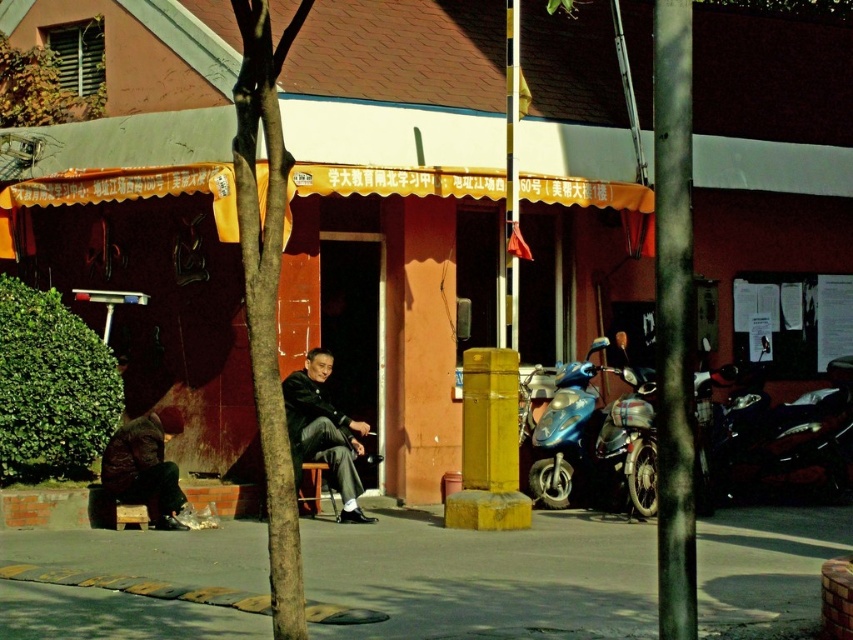
Question: Observing the image, what is the correct spatial positioning of brown leather jacket at lower left in reference to wooden chair at center?

Choices:
 (A) above
 (B) below

Answer: (A)

Question: Can you confirm if blue metallic motorcycle at lower right is bigger than wooden chair at center?

Choices:
 (A) no
 (B) yes

Answer: (B)

Question: Which of the following is the farthest from the observer?

Choices:
 (A) blue metallic motorcycle at lower right
 (B) dark gray fabric jacket at center

Answer: (A)

Question: Which object appears farthest from the camera in this image?

Choices:
 (A) blue metallic motorcycle at lower right
 (B) brown leather jacket at lower left

Answer: (A)

Question: Is smooth brown tree trunk at center-left below dark gray fabric jacket at center?

Choices:
 (A) yes
 (B) no

Answer: (B)

Question: Among these points, which one is farthest from the camera?

Choices:
 (A) click(252, 186)
 (B) click(296, 486)
 (C) click(611, 464)
 (D) click(131, 550)

Answer: (C)